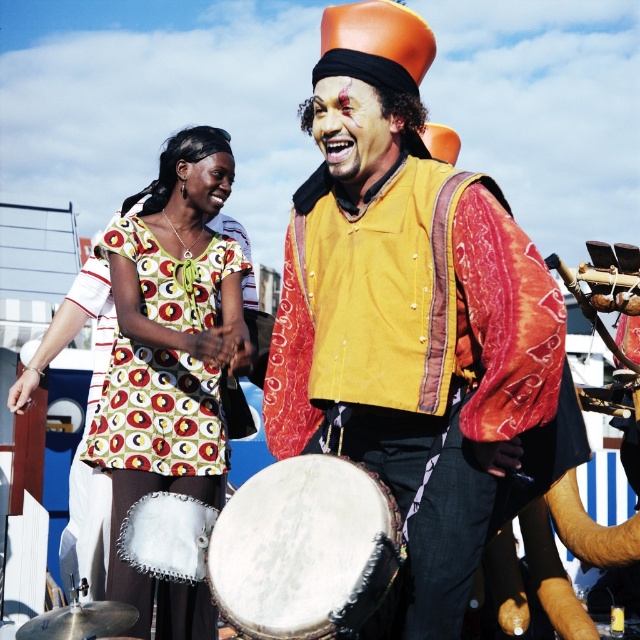
You are a photographer standing at the center of the scene. You need to take a photo of both the printed fabric dress at left and the matte skin face at center. Considering the distance between them, will you be able to capture both in a single frame without moving the camera?

The distance between the printed fabric dress at left and the matte skin face at center is 14.34 feet. Since the photographer is at the center, the dress is 7.17 feet to the left and the face is 7.17 feet to the right. Most camera lenses can capture this distance within a single frame without needing to move the camera.

You are a photographer trying to capture a photo of the white leather drum at center and the matte skin face at center. Which object should you focus on first if you want to ensure both are in focus?

The white leather drum at center is located below matte skin face at center. Since the matte skin face at center is higher up, you should focus on it first to ensure both are in focus.

You are standing at the origin of the coordinate system in the scene. You see two points, point (157, 282) and point (218, 163). Which point is closer to you?

Point (157, 282) is in front of point (218, 163), so it is closer to you.